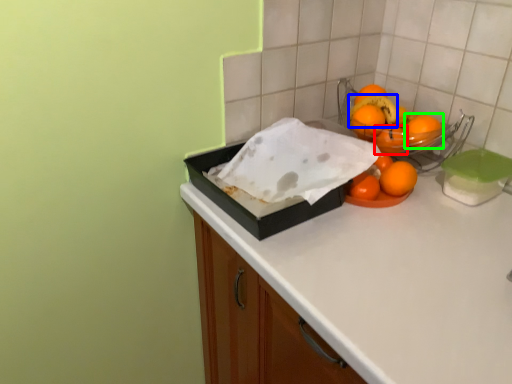
Question: Which object is the farthest from orange (highlighted by a red box)? Choose among these: fruit (highlighted by a blue box) or orange (highlighted by a green box).

Choices:
 (A) fruit
 (B) orange

Answer: (A)